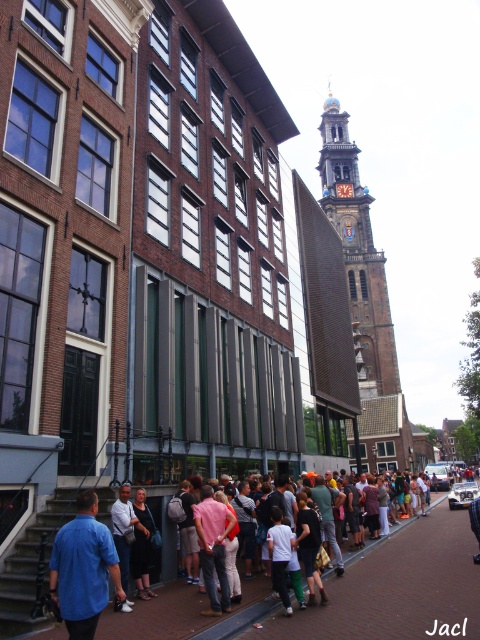
Looking at this image, you are a tourist standing on the sidewalk in this European city scene. You see the brick pavement at lower center and the white shirt at center. Which object is positioned to the left of the other?

The white shirt at center is to the left of the brick pavement at lower center because the brick pavement at lower center is to the right of white shirt at center.